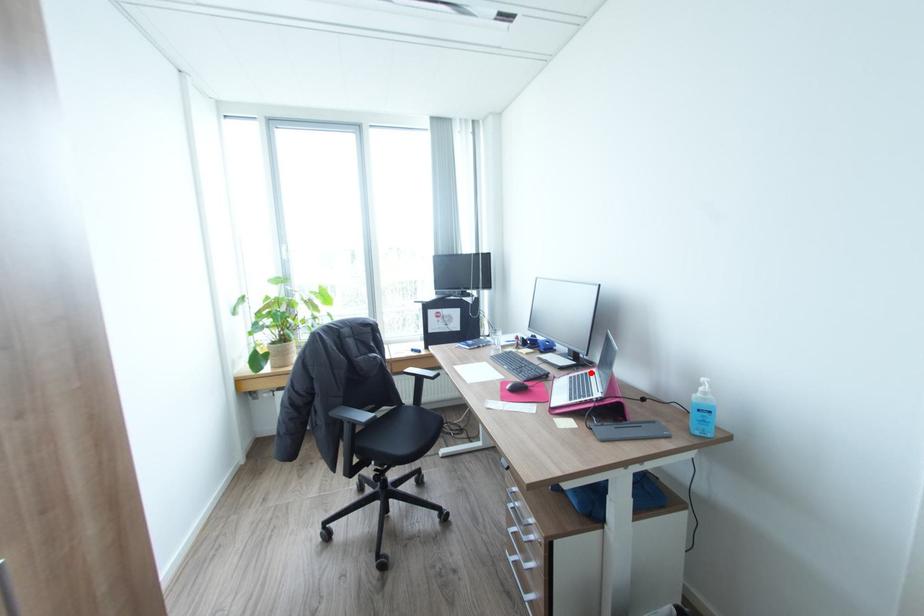
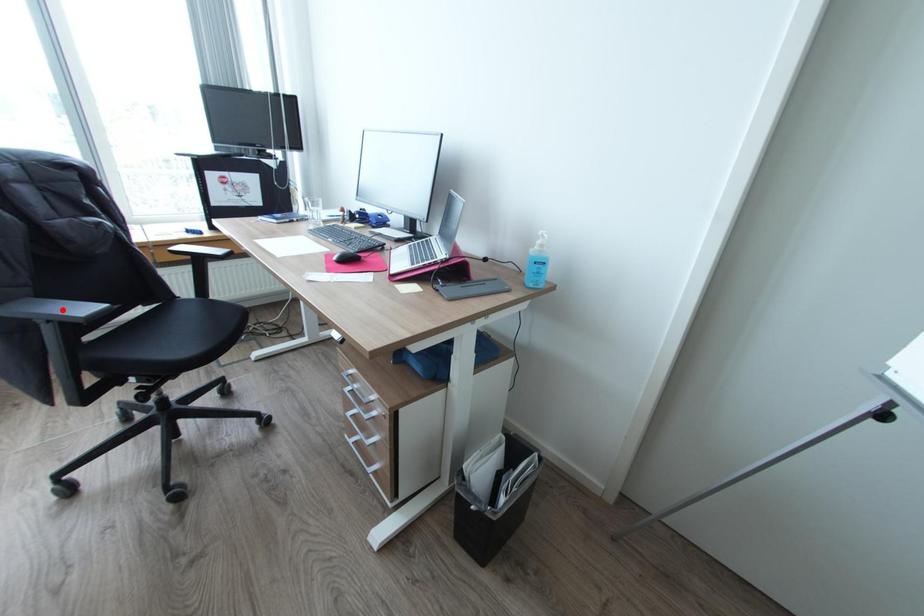
I am providing you with two images of the same scene from different viewpoints. A red point is marked on the first image and another point is marked on the second image. Is the marked point in image1 the same physical position as the marked point in image2?

No